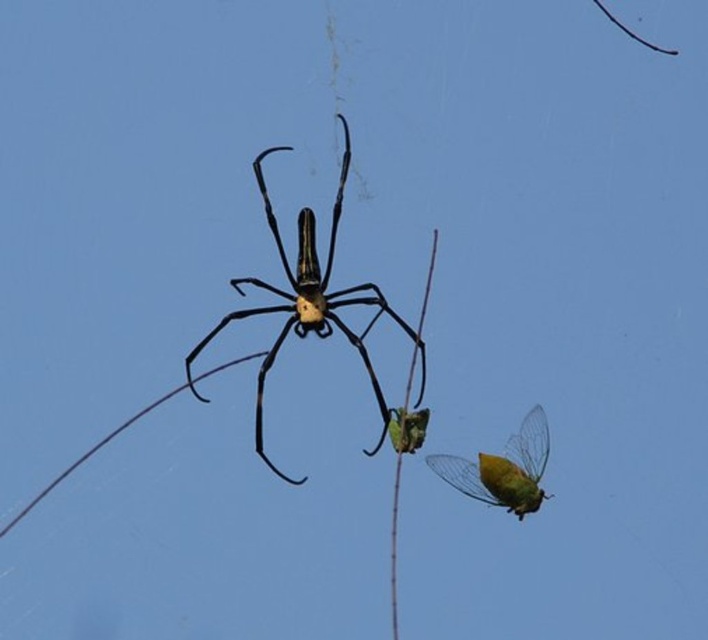
Question: Which of the following is the farthest from the observer?

Choices:
 (A) (299, 272)
 (B) (452, 484)

Answer: (A)

Question: Does translucent golden spider at center appear over translucent yellow-green wing at lower right?

Choices:
 (A) yes
 (B) no

Answer: (A)

Question: Is translucent golden spider at center to the right of translucent yellow-green wing at lower right from the viewer's perspective?

Choices:
 (A) no
 (B) yes

Answer: (A)

Question: Which object appears farthest from the camera in this image?

Choices:
 (A) translucent yellow-green wing at lower right
 (B) translucent golden spider at center

Answer: (B)

Question: Among these objects, which one is nearest to the camera?

Choices:
 (A) translucent yellow-green wing at lower right
 (B) translucent golden spider at center

Answer: (A)

Question: Does translucent golden spider at center appear over translucent yellow-green wing at lower right?

Choices:
 (A) no
 (B) yes

Answer: (B)